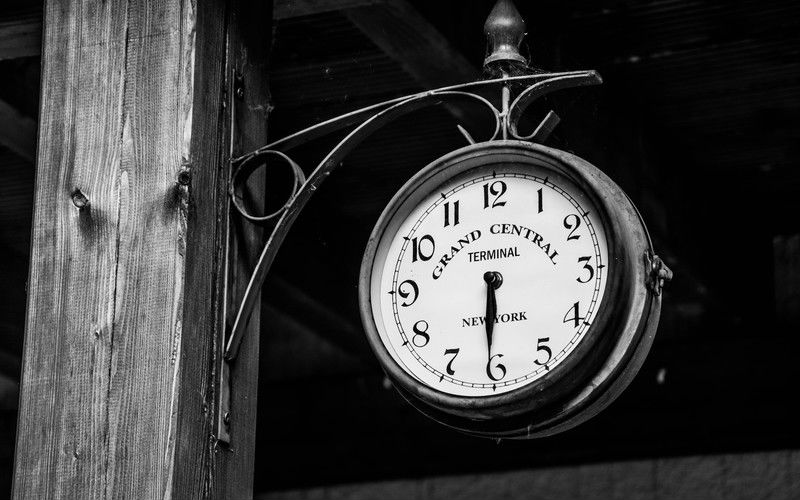
This screenshot has height=500, width=800. What are the coordinates of `black clock hand` in the screenshot? It's located at (490, 310).